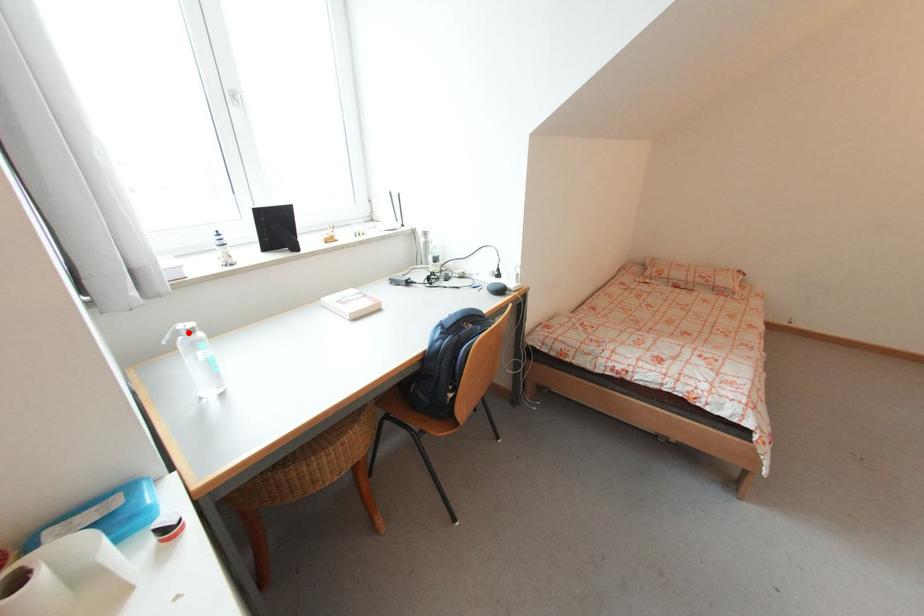
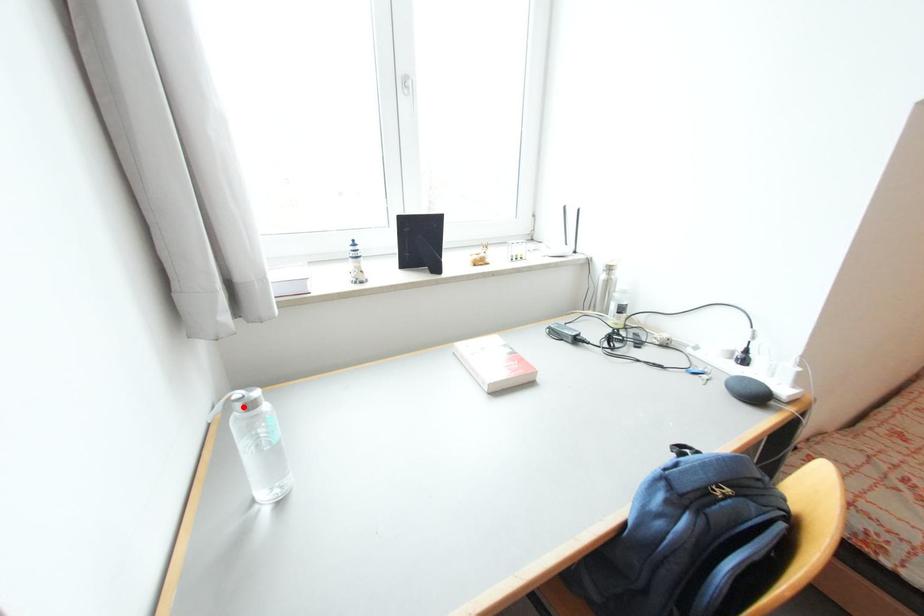
I am providing you with two images of the same scene from different viewpoints. A red point is marked on the first image and another point is marked on the second image. Are the points marked in image1 and image2 representing the same 3D position?

Yes